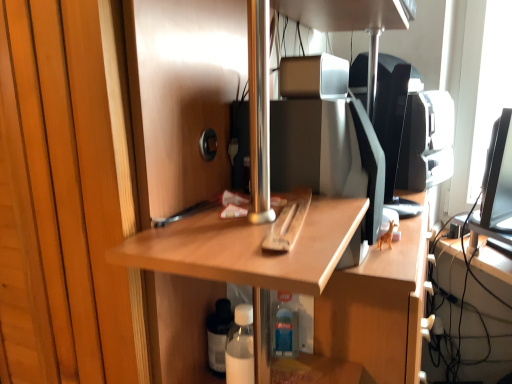
Locate an element on the screen. translucent plastic bottle at center is located at coordinates (285, 328).

Describe the element at coordinates (285, 328) in the screenshot. The width and height of the screenshot is (512, 384). I see `translucent plastic bottle at center` at that location.

The width and height of the screenshot is (512, 384). In order to click on translucent plastic bottle at center in this screenshot , I will do `click(285, 328)`.